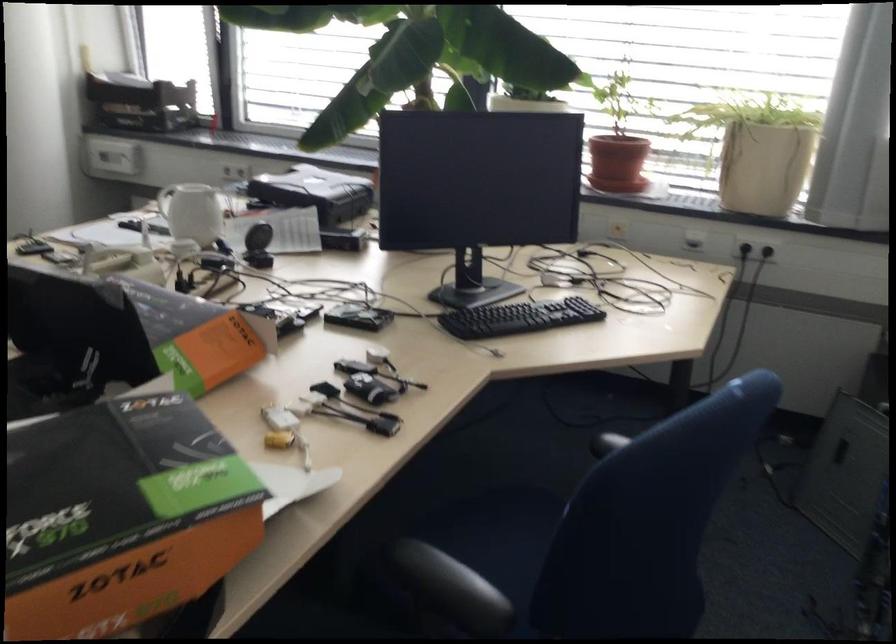
The location [616,163] corresponds to which object?

It corresponds to the brown flower pot in the image.